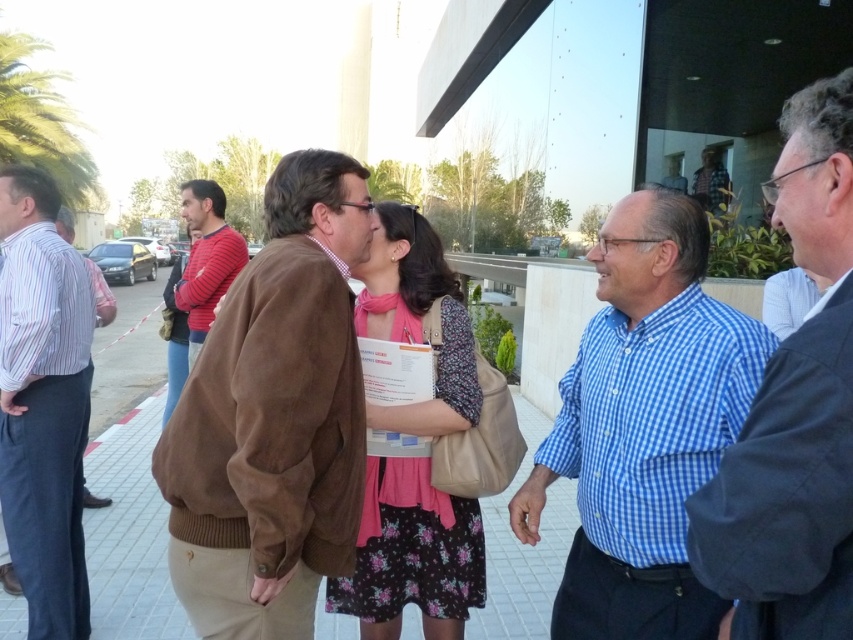
You are a photographer trying to capture a group photo of the dark blue checkered shirt at right and the floral dress at center. Which of the two should you zoom in more on to ensure they appear equally sized in the photo?

You should zoom in more on the dark blue checkered shirt at right since it is smaller in size compared to the floral dress at center, so to make them appear equally sized in the photo, the smaller one needs more zoom.